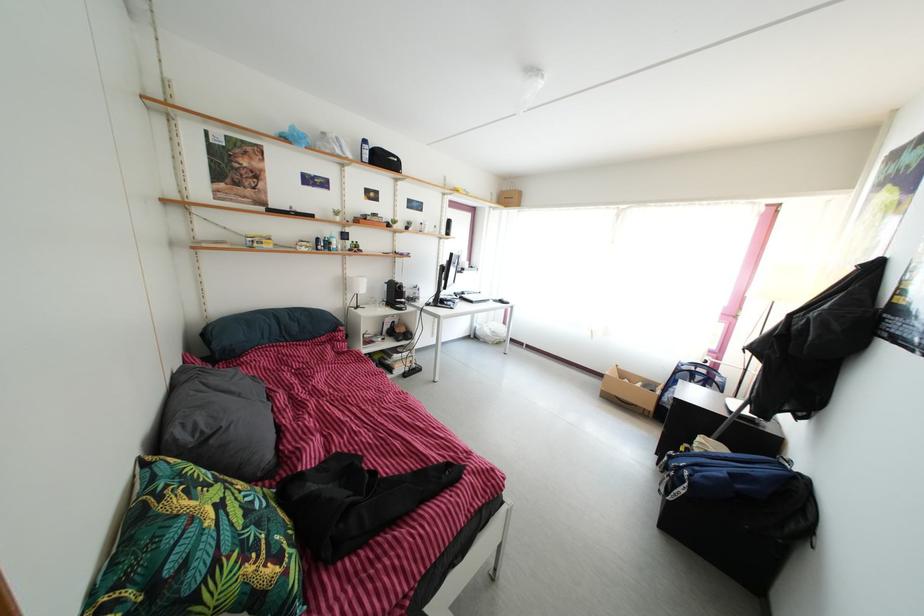
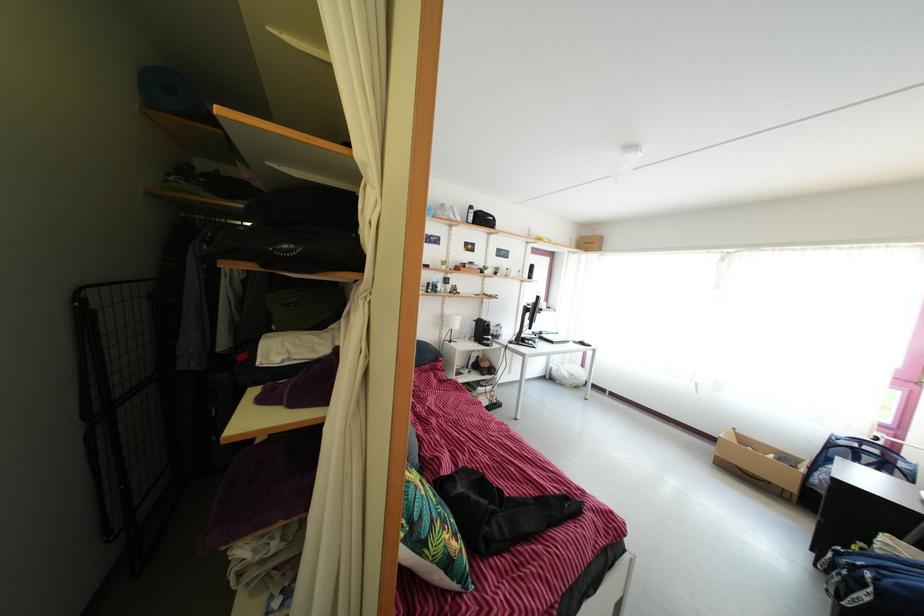
Locate, in the second image, the point that corresponds to point 350,277 in the first image.

(448, 315)